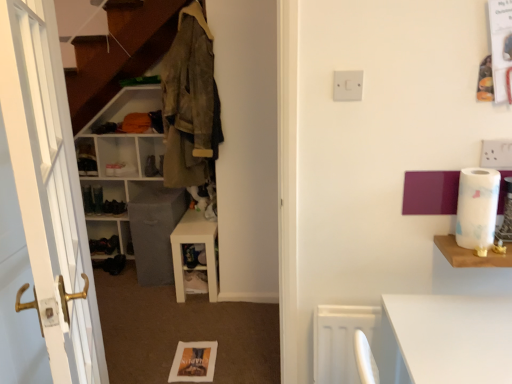
Question: From a real-world perspective, is white marble toilet paper at right below white plastic switch at upper center?

Choices:
 (A) no
 (B) yes

Answer: (B)

Question: Is white marble toilet paper at right wider than white plastic switch at upper center?

Choices:
 (A) no
 (B) yes

Answer: (B)

Question: Does white marble toilet paper at right come in front of white plastic switch at upper center?

Choices:
 (A) no
 (B) yes

Answer: (B)

Question: Would you say white marble toilet paper at right is a long distance from white plastic switch at upper center?

Choices:
 (A) no
 (B) yes

Answer: (A)

Question: From the image's perspective, does white marble toilet paper at right appear higher than white plastic switch at upper center?

Choices:
 (A) no
 (B) yes

Answer: (A)

Question: From a real-world perspective, is white matte shelf at center, the 3th shelf from the front, above or below black leather shoe at lower left?

Choices:
 (A) below
 (B) above

Answer: (B)

Question: In terms of width, does white matte shelf at center, the 3th shelf from the front, look wider or thinner when compared to black leather shoe at lower left?

Choices:
 (A) wide
 (B) thin

Answer: (A)

Question: Is point (144, 152) positioned closer to the camera than point (89, 241)?

Choices:
 (A) closer
 (B) farther

Answer: (B)

Question: From the image's perspective, is white matte shelf at center, marked as the third shelf in a right-to-left arrangement, above or below black leather shoe at lower left?

Choices:
 (A) below
 (B) above

Answer: (B)

Question: From the image's perspective, is white plastic switch at upper center positioned above or below camouflage fabric jacket at upper left?

Choices:
 (A) above
 (B) below

Answer: (B)

Question: In terms of height, does white plastic switch at upper center look taller or shorter compared to camouflage fabric jacket at upper left?

Choices:
 (A) short
 (B) tall

Answer: (A)

Question: Does point 333,92 appear closer or farther from the camera than point 201,125?

Choices:
 (A) farther
 (B) closer

Answer: (B)

Question: Is white plastic switch at upper center to the left or to the right of camouflage fabric jacket at upper left in the image?

Choices:
 (A) left
 (B) right

Answer: (B)

Question: Do you think wooden shelf at right, acting as the third shelf starting from the back, is within white matte shelf at center, the 3th shelf from the front, or outside of it?

Choices:
 (A) inside
 (B) outside

Answer: (B)

Question: Visually, is wooden shelf at right, the third shelf positioned from the left, positioned to the left or to the right of white matte shelf at center, positioned as the 1th shelf in left-to-right order?

Choices:
 (A) left
 (B) right

Answer: (B)